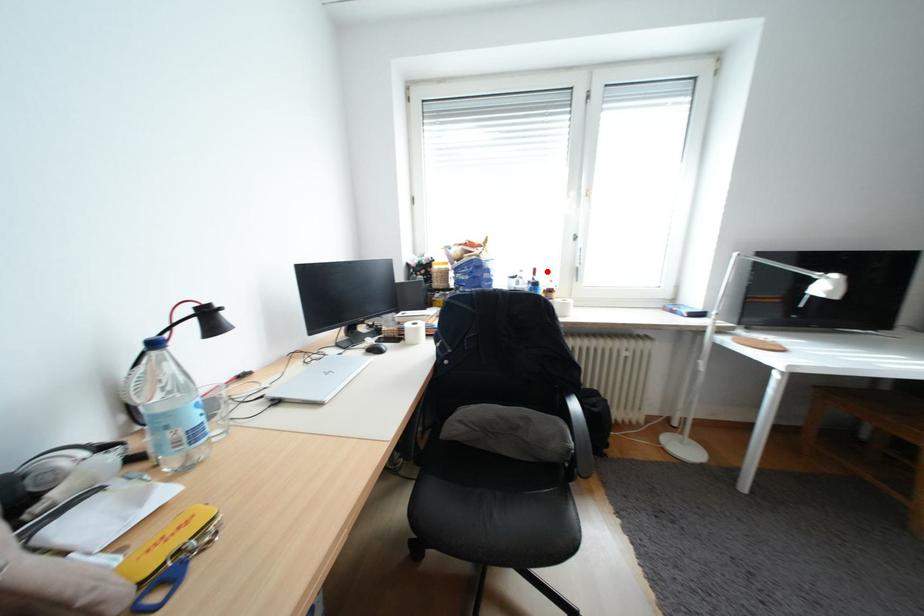
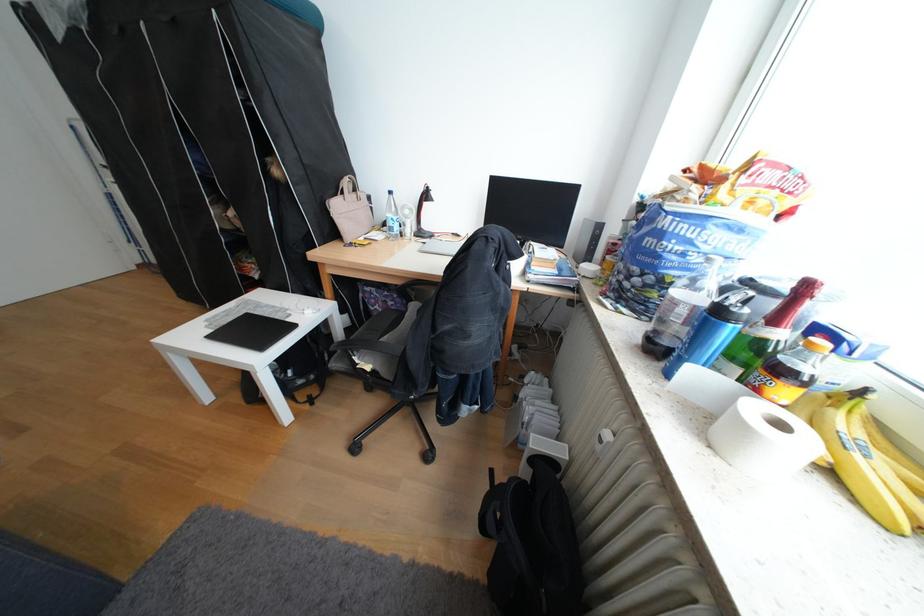
In the second image, find the point that corresponds to the highlighted location in the first image.

(819, 288)